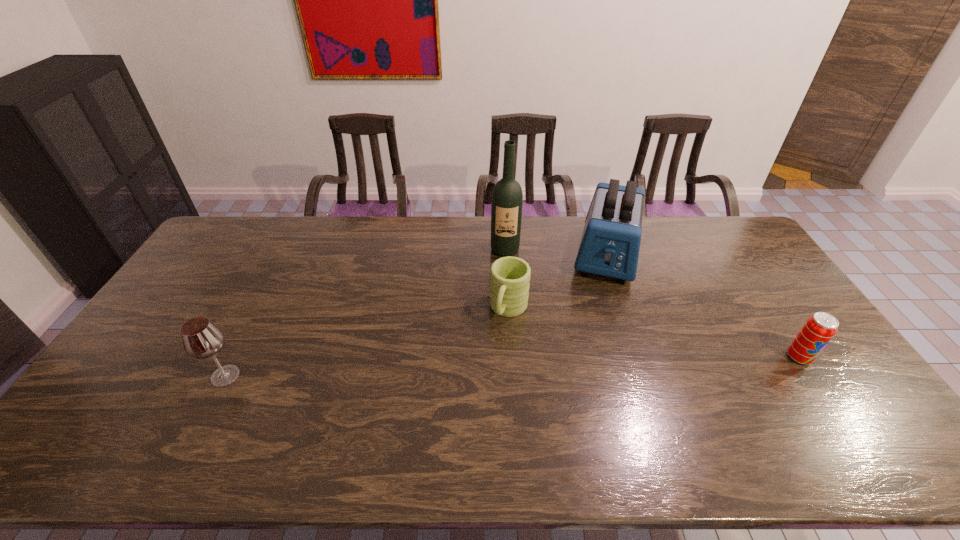
At what (x,y) coordinates should I click in order to perform the action: click on vacant spot on the desktop that is between the third tallest object and the soda can and is positioned on the labeled side of the wine bottle. Please return your answer as a coordinate pair (x, y). This screenshot has height=540, width=960. Looking at the image, I should click on (506, 367).

Locate an element on the screen. The width and height of the screenshot is (960, 540). free space on the desktop that is between the wineglass and the soda can and is positioned on the side of the mug with the handle is located at coordinates (482, 367).

Where is `vacant space on the desktop that is between the third shortest object and the soda can and is positioned on the front-facing side of the second object from right to left`? The image size is (960, 540). vacant space on the desktop that is between the third shortest object and the soda can and is positioned on the front-facing side of the second object from right to left is located at coordinates (588, 364).